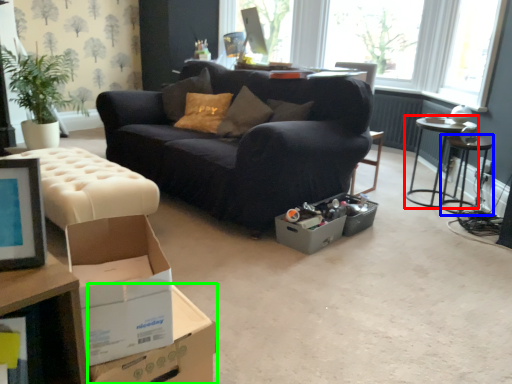
Question: Based on their relative distances, which object is farther from table (highlighted by a red box)? Choose from side table (highlighted by a blue box) and cardboard box (highlighted by a green box).

Choices:
 (A) side table
 (B) cardboard box

Answer: (B)